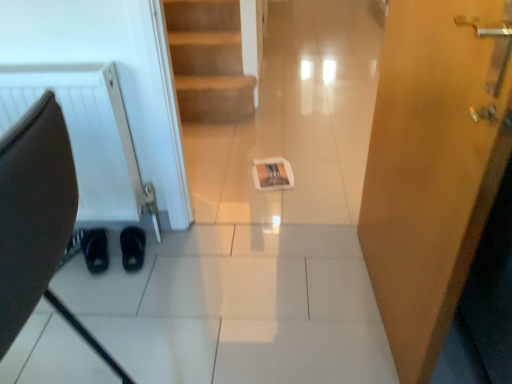
Identify the location of vacant region to the left of black suede shoes at lower left, the first footwear from the left. The height and width of the screenshot is (384, 512). (71, 251).